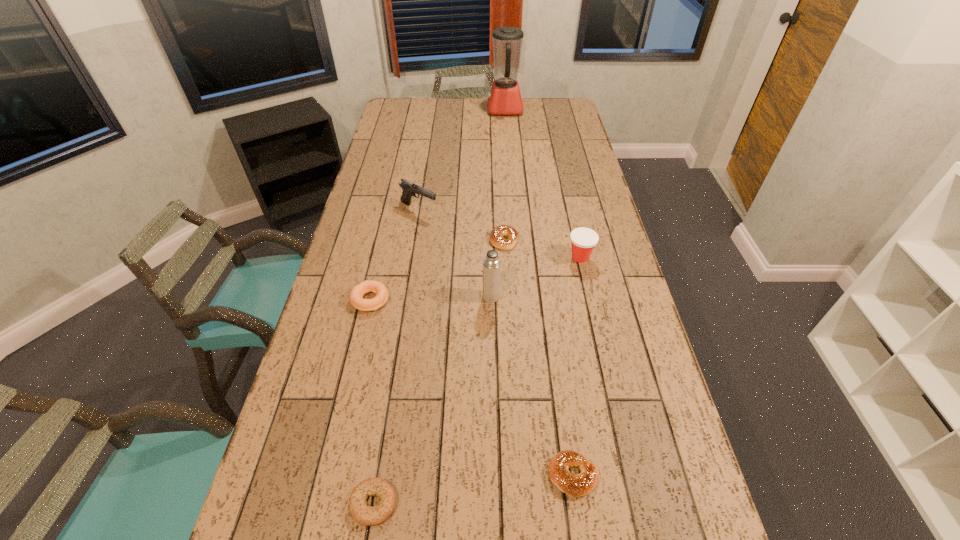
At what (x,y) coordinates should I click in order to perform the action: click on object that is at the far edge. Please return your answer as a coordinate pair (x, y). This screenshot has height=540, width=960. Looking at the image, I should click on click(x=504, y=98).

Where is `object present at the left edge`? The image size is (960, 540). object present at the left edge is located at coordinates (377, 287).

You are a GUI agent. You are given a task and a screenshot of the screen. Output one action in this format:
    pyautogui.click(x=<x>, y=<y>)
    Task: Click on the object located at the right edge
    This screenshot has width=960, height=540.
    Given the screenshot: What is the action you would take?
    pyautogui.click(x=583, y=240)

This screenshot has height=540, width=960. Identify the location of free space at the left edge of the desktop. (403, 140).

In the image, there is a desktop. At what (x,y) coordinates should I click in order to perform the action: click on vacant space at the right edge. Please return your answer as a coordinate pair (x, y). This screenshot has width=960, height=540. Looking at the image, I should click on (568, 191).

Locate an element on the screen. free space between the third bagel from left to right and the rightmost bagel is located at coordinates (539, 357).

Identify the location of unoccupied position between the rightmost bagel and the tallest bagel. (471, 387).

Find the location of a particular element. Image resolution: width=960 pixels, height=540 pixels. free spot between the fifth tallest object and the rightmost object is located at coordinates (475, 279).

You are a GUI agent. You are given a task and a screenshot of the screen. Output one action in this format:
    pyautogui.click(x=<x>, y=<y>)
    Task: Click on the empty space that is in between the fourth tallest object and the third nearest bagel
    The height and width of the screenshot is (540, 960).
    Given the screenshot: What is the action you would take?
    pyautogui.click(x=475, y=279)

Find the location of a particular element. Image resolution: width=960 pixels, height=540 pixels. free point between the rightmost bagel and the tallest object is located at coordinates (539, 292).